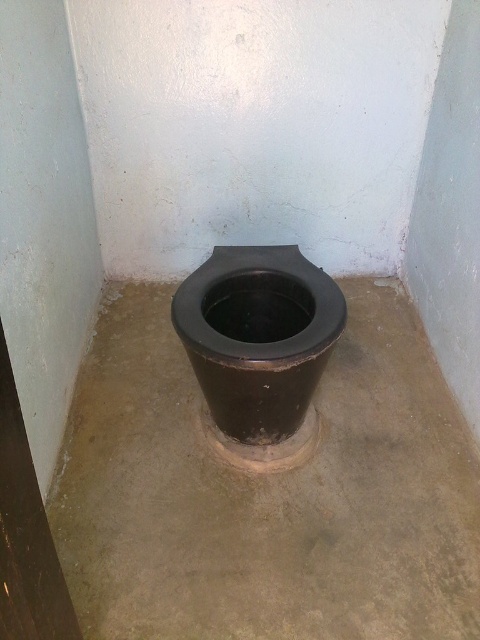
Question: Does black matte cement at center appear on the left side of black matte toilet bowl at center?

Choices:
 (A) no
 (B) yes

Answer: (A)

Question: Does black matte cement at center have a larger size compared to black matte toilet bowl at center?

Choices:
 (A) no
 (B) yes

Answer: (B)

Question: Which object is farther from the camera taking this photo?

Choices:
 (A) black matte toilet bowl at center
 (B) black matte cement at center

Answer: (A)

Question: Which point is farther from the camera taking this photo?

Choices:
 (A) (252, 570)
 (B) (295, 316)

Answer: (B)

Question: Considering the relative positions of black matte cement at center and black matte toilet bowl at center in the image provided, where is black matte cement at center located with respect to black matte toilet bowl at center?

Choices:
 (A) below
 (B) above

Answer: (A)